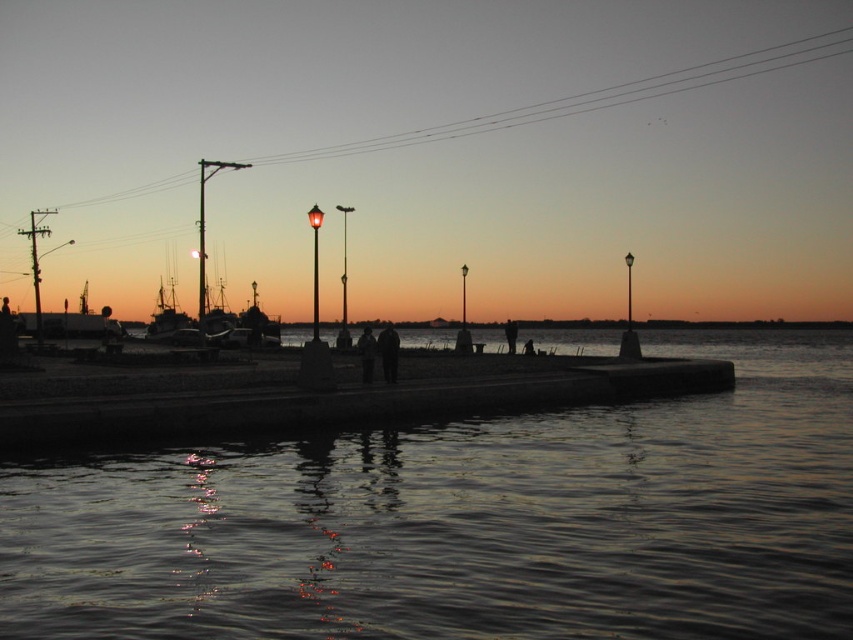
Which is in front, point (525, 481) or point (381, 333)?

Point (525, 481) is in front.

Which is more to the left, dark reflective water at center or dark textured pants at center?

→ dark textured pants at center is more to the left.

Does point (281, 620) come closer to viewer compared to point (381, 362)?

Yes, point (281, 620) is closer to viewer.

Where is `dark reflective water at center`? The height and width of the screenshot is (640, 853). dark reflective water at center is located at coordinates (466, 520).

This screenshot has width=853, height=640. Identify the location of dark textured pants at center. (387, 353).

Can you confirm if dark textured pants at center is thinner than dark blue jeans at center?

No, dark textured pants at center is not thinner than dark blue jeans at center.

What do you see at coordinates (387, 353) in the screenshot? The image size is (853, 640). I see `dark textured pants at center` at bounding box center [387, 353].

What are the coordinates of `dark textured pants at center` in the screenshot? It's located at (387, 353).

Based on the photo, does concrete dock at center have a greater width compared to dark textured pants at center?

Yes, concrete dock at center is wider than dark textured pants at center.

Does point (393, 392) come behind point (387, 323)?

That is False.

Where is `concrete dock at center`? The width and height of the screenshot is (853, 640). concrete dock at center is located at coordinates (332, 396).

You are a GUI agent. You are given a task and a screenshot of the screen. Output one action in this format:
    pyautogui.click(x=<x>, y=<y>)
    Task: Click on the concrete dock at center
    Image resolution: width=853 pixels, height=640 pixels.
    Given the screenshot: What is the action you would take?
    pyautogui.click(x=332, y=396)